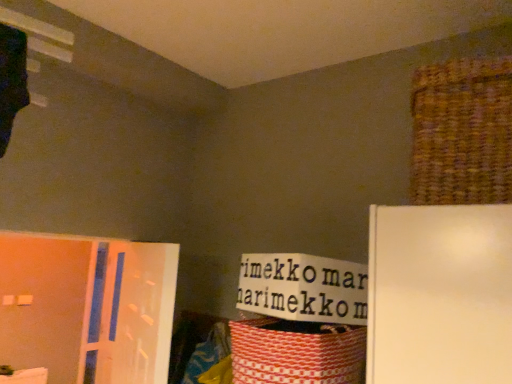
What do you see at coordinates (462, 132) in the screenshot?
I see `brown woven basket at upper right, which appears as the 1th basket when viewed from the top` at bounding box center [462, 132].

Where is `brown woven basket at upper right, which appears as the 2th basket when viewed from the left`? This screenshot has height=384, width=512. brown woven basket at upper right, which appears as the 2th basket when viewed from the left is located at coordinates (462, 132).

Based on their sizes in the image, would you say brown woven basket at upper right, which appears as the 2th basket when viewed from the left, is bigger or smaller than red woven basket at lower right, marked as the 2th basket in a top-to-bottom arrangement?

Considering their sizes, brown woven basket at upper right, which appears as the 2th basket when viewed from the left, takes up more space than red woven basket at lower right, marked as the 2th basket in a top-to-bottom arrangement.

Based on the photo, are brown woven basket at upper right, the first basket when ordered from right to left, and red woven basket at lower right, marked as the 1th basket in a bottom-to-top arrangement, far apart?

No, brown woven basket at upper right, the first basket when ordered from right to left, is in close proximity to red woven basket at lower right, marked as the 1th basket in a bottom-to-top arrangement.

From a real-world perspective, who is located lower, brown woven basket at upper right, which appears as the 1th basket when viewed from the top, or red woven basket at lower right, marked as the 2th basket in a top-to-bottom arrangement?

From a 3D spatial view, red woven basket at lower right, marked as the 2th basket in a top-to-bottom arrangement, is below.

Which is less distant, (419,184) or (249,330)?

Clearly, point (419,184) is closer to the camera than point (249,330).

From the image's perspective, is translucent plastic screen door at left on red woven basket at lower right, marked as the 1th basket in a bottom-to-top arrangement?

Actually, translucent plastic screen door at left appears below red woven basket at lower right, marked as the 1th basket in a bottom-to-top arrangement, in the image.

Considering the positions of objects translucent plastic screen door at left and red woven basket at lower right, positioned as the second basket in right-to-left order, in the image provided, who is more to the right, translucent plastic screen door at left or red woven basket at lower right, positioned as the second basket in right-to-left order,?

From the viewer's perspective, red woven basket at lower right, positioned as the second basket in right-to-left order, appears more on the right side.

Is translucent plastic screen door at left in contact with red woven basket at lower right, marked as the 2th basket in a top-to-bottom arrangement?

No, translucent plastic screen door at left is not next to red woven basket at lower right, marked as the 2th basket in a top-to-bottom arrangement.

Which of these two, translucent plastic screen door at left or red woven basket at lower right, positioned as the second basket in right-to-left order, stands taller?

Standing taller between the two is translucent plastic screen door at left.

Considering the relative sizes of translucent plastic screen door at left and brown woven basket at upper right, the first basket when ordered from right to left, in the image provided, is translucent plastic screen door at left wider than brown woven basket at upper right, the first basket when ordered from right to left,?

Incorrect, the width of translucent plastic screen door at left does not surpass that of brown woven basket at upper right, the first basket when ordered from right to left.

Identify the location of screen door below the brown woven basket at upper right, the first basket when ordered from right to left (from a real-world perspective). The image size is (512, 384). (129, 313).

Looking at this image, does translucent plastic screen door at left appear on the left side of brown woven basket at upper right, which appears as the 1th basket when viewed from the top?

Correct, you'll find translucent plastic screen door at left to the left of brown woven basket at upper right, which appears as the 1th basket when viewed from the top.

From the image's perspective, is translucent plastic screen door at left positioned above or below brown woven basket at upper right, which is the 2th basket from bottom to top?

From the image's perspective, translucent plastic screen door at left appears below brown woven basket at upper right, which is the 2th basket from bottom to top.

From a real-world perspective, is brown woven basket at upper right, which appears as the 1th basket when viewed from the top, positioned under translucent plastic screen door at left based on gravity?

No, from a real-world perspective, brown woven basket at upper right, which appears as the 1th basket when viewed from the top, is not under translucent plastic screen door at left.

Considering the relative sizes of brown woven basket at upper right, which appears as the 2th basket when viewed from the left, and translucent plastic screen door at left in the image provided, is brown woven basket at upper right, which appears as the 2th basket when viewed from the left, shorter than translucent plastic screen door at left?

Yes.

What's the angular difference between brown woven basket at upper right, which is the 2th basket from bottom to top, and translucent plastic screen door at left's facing directions?

6.49 degrees separate the facing orientations of brown woven basket at upper right, which is the 2th basket from bottom to top, and translucent plastic screen door at left.

Are brown woven basket at upper right, which is the 2th basket from bottom to top, and translucent plastic screen door at left far apart?

Yes, brown woven basket at upper right, which is the 2th basket from bottom to top, is far from translucent plastic screen door at left.

Which object is closer to the camera taking this photo, red woven basket at lower right, which is the 1th basket from left to right, or translucent plastic screen door at left?

red woven basket at lower right, which is the 1th basket from left to right, is more forward.

Considering the relative positions of red woven basket at lower right, which is the 1th basket from left to right, and translucent plastic screen door at left in the image provided, is red woven basket at lower right, which is the 1th basket from left to right, to the left or to the right of translucent plastic screen door at left?

In the image, red woven basket at lower right, which is the 1th basket from left to right, appears on the right side of translucent plastic screen door at left.

The image size is (512, 384). In the image, there is a red woven basket at lower right, marked as the 1th basket in a bottom-to-top arrangement. What are the coordinates of `screen door below it (from the image's perspective)` in the screenshot? It's located at (129, 313).

Is red woven basket at lower right, marked as the 2th basket in a top-to-bottom arrangement, placed right next to translucent plastic screen door at left?

No, red woven basket at lower right, marked as the 2th basket in a top-to-bottom arrangement, is not touching translucent plastic screen door at left.

Looking at their sizes, would you say red woven basket at lower right, positioned as the second basket in right-to-left order, is wider or thinner than brown woven basket at upper right, which appears as the 1th basket when viewed from the top?

red woven basket at lower right, positioned as the second basket in right-to-left order, is thinner than brown woven basket at upper right, which appears as the 1th basket when viewed from the top.

Consider the image. From a real-world perspective, who is located lower, red woven basket at lower right, marked as the 2th basket in a top-to-bottom arrangement, or brown woven basket at upper right, which appears as the 1th basket when viewed from the top?

red woven basket at lower right, marked as the 2th basket in a top-to-bottom arrangement.

Are red woven basket at lower right, marked as the 1th basket in a bottom-to-top arrangement, and brown woven basket at upper right, which is the 2th basket from bottom to top, located far from each other?

They are positioned close to each other.

Can we say red woven basket at lower right, which is the 1th basket from left to right, lies outside brown woven basket at upper right, which appears as the 1th basket when viewed from the top?

Yes, red woven basket at lower right, which is the 1th basket from left to right, is outside of brown woven basket at upper right, which appears as the 1th basket when viewed from the top.

Where is `basket located behind the brown woven basket at upper right, which appears as the 2th basket when viewed from the left`? Image resolution: width=512 pixels, height=384 pixels. basket located behind the brown woven basket at upper right, which appears as the 2th basket when viewed from the left is located at coordinates (296, 352).

Where is `screen door on the left of red woven basket at lower right, marked as the 1th basket in a bottom-to-top arrangement`? The width and height of the screenshot is (512, 384). screen door on the left of red woven basket at lower right, marked as the 1th basket in a bottom-to-top arrangement is located at coordinates (129, 313).

Which object lies nearer to the anchor point brown woven basket at upper right, which appears as the 1th basket when viewed from the top, red woven basket at lower right, which is the 1th basket from left to right, or translucent plastic screen door at left?

Among the two, red woven basket at lower right, which is the 1th basket from left to right, is located nearer to brown woven basket at upper right, which appears as the 1th basket when viewed from the top.

When comparing their distances from brown woven basket at upper right, which is the 2th basket from bottom to top, does translucent plastic screen door at left or red woven basket at lower right, marked as the 2th basket in a top-to-bottom arrangement, seem closer?

Based on the image, red woven basket at lower right, marked as the 2th basket in a top-to-bottom arrangement, appears to be nearer to brown woven basket at upper right, which is the 2th basket from bottom to top.

Based on their spatial positions, is red woven basket at lower right, marked as the 2th basket in a top-to-bottom arrangement, or brown woven basket at upper right, which is the 2th basket from bottom to top, closer to translucent plastic screen door at left?

red woven basket at lower right, marked as the 2th basket in a top-to-bottom arrangement.

When comparing their distances from translucent plastic screen door at left, does brown woven basket at upper right, which is the 2th basket from bottom to top, or red woven basket at lower right, marked as the 1th basket in a bottom-to-top arrangement, seem closer?

red woven basket at lower right, marked as the 1th basket in a bottom-to-top arrangement, is closer to translucent plastic screen door at left.

Estimate the real-world distances between objects in this image. Which object is closer to red woven basket at lower right, marked as the 2th basket in a top-to-bottom arrangement, translucent plastic screen door at left or brown woven basket at upper right, which appears as the 1th basket when viewed from the top?

translucent plastic screen door at left lies closer to red woven basket at lower right, marked as the 2th basket in a top-to-bottom arrangement, than the other object.

From the image, which object appears to be farther from red woven basket at lower right, which is the 1th basket from left to right, brown woven basket at upper right, which is the 2th basket from bottom to top, or translucent plastic screen door at left?

The object further to red woven basket at lower right, which is the 1th basket from left to right, is brown woven basket at upper right, which is the 2th basket from bottom to top.

In order to click on basket located between brown woven basket at upper right, which appears as the 2th basket when viewed from the left, and translucent plastic screen door at left in the depth direction in this screenshot , I will do `click(296, 352)`.